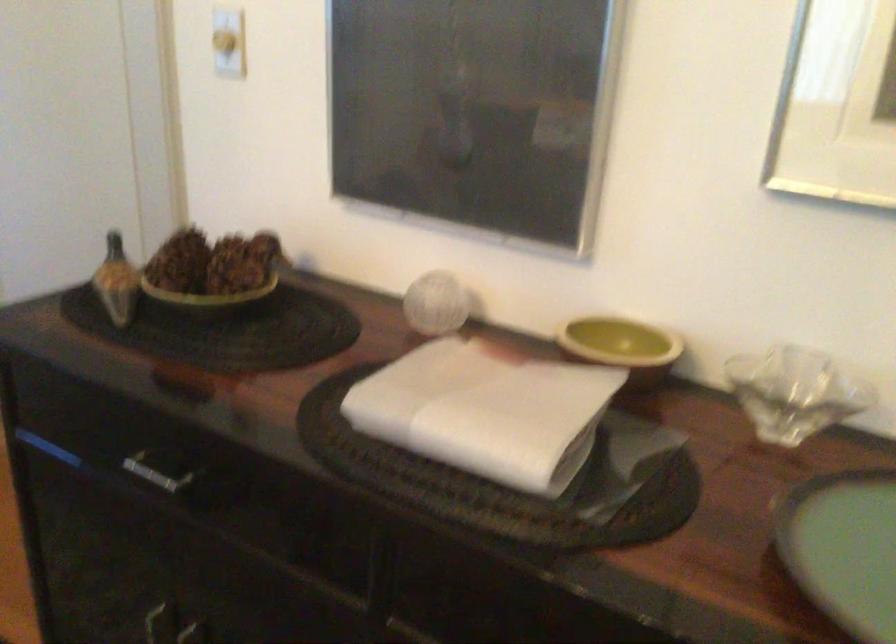
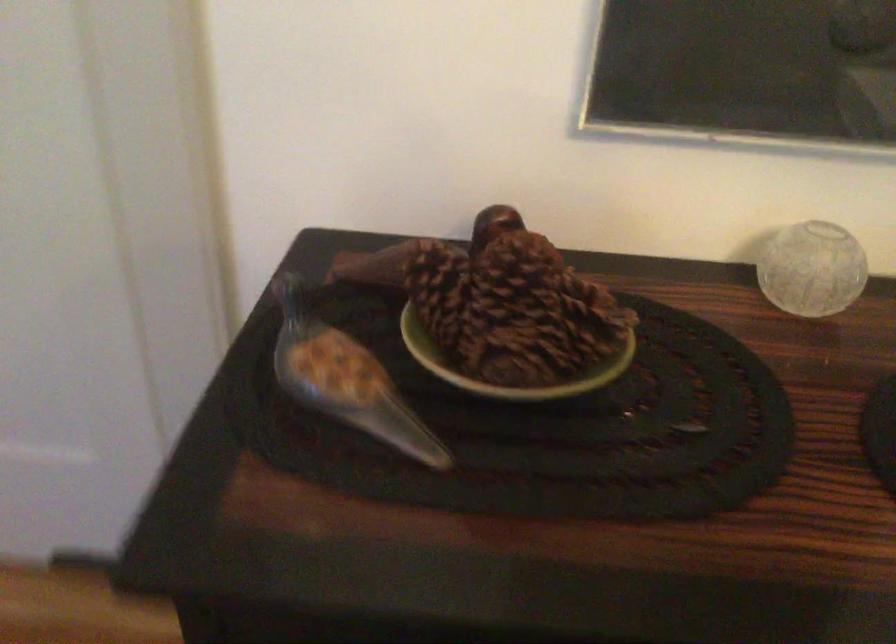
The point at (170, 260) is marked in the first image. Where is the corresponding point in the second image?

(440, 292)